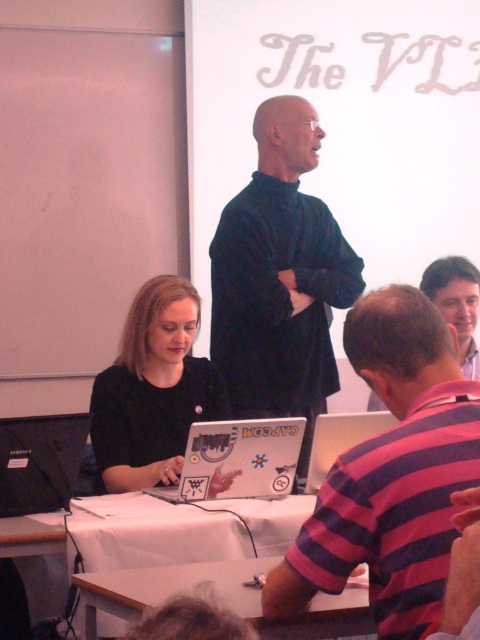
Question: Does white cloth-covered table at center appear on the right side of white matte laptop at lower center?

Choices:
 (A) no
 (B) yes

Answer: (A)

Question: Estimate the real-world distances between objects in this image. Which object is farther from the pink striped shirt at lower right?

Choices:
 (A) black matte sweater at center
 (B) white cloth-covered table at center
 (C) pink striped shirt at center
 (D) matte black laptop at lower left

Answer: (C)

Question: Can you confirm if black matte sweater at center is smaller than white glossy laptop at center?

Choices:
 (A) yes
 (B) no

Answer: (B)

Question: Which point is closer to the camera taking this photo?

Choices:
 (A) (304, 420)
 (B) (359, 440)

Answer: (A)

Question: Does pink striped shirt at center come behind wooden table at lower center?

Choices:
 (A) no
 (B) yes

Answer: (A)

Question: Which object is the closest to the black matte sweater at center?

Choices:
 (A) wooden table at lower center
 (B) pink striped shirt at lower right
 (C) white glossy laptop at center
 (D) white matte laptop at lower center

Answer: (B)